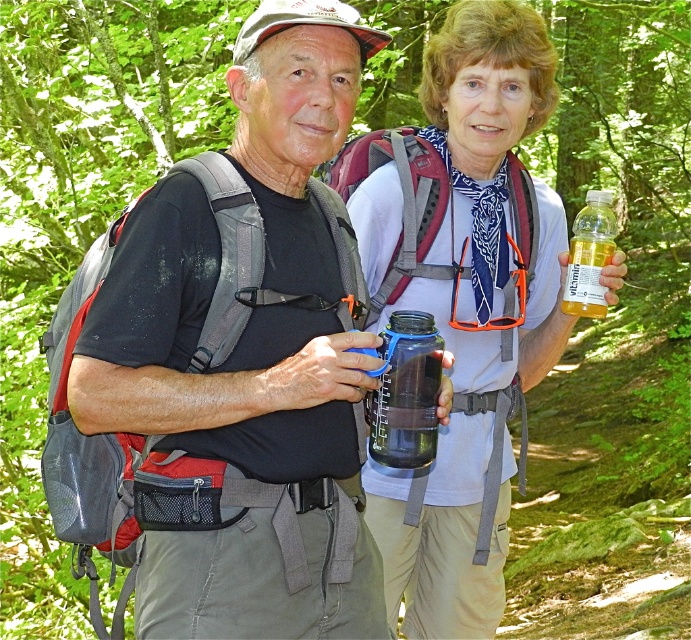
Question: Is transparent plastic water bottle at center bigger than translucent yellow bottle at center?

Choices:
 (A) yes
 (B) no

Answer: (B)

Question: Among these objects, which one is nearest to the camera?

Choices:
 (A) transparent plastic water bottle at center
 (B) translucent yellow bottle at center

Answer: (A)

Question: Considering the relative positions of transparent plastic water bottle at center and translucent yellow bottle at center in the image provided, where is transparent plastic water bottle at center located with respect to translucent yellow bottle at center?

Choices:
 (A) left
 (B) right

Answer: (A)

Question: Does transparent plastic water bottle at center have a smaller size compared to translucent yellow bottle at center?

Choices:
 (A) yes
 (B) no

Answer: (A)